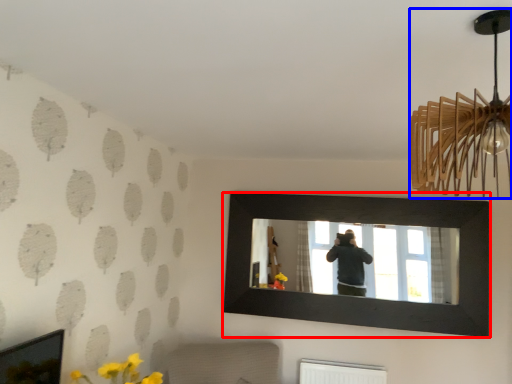
Question: Which point is further to the camera, picture frame (highlighted by a red box) or lamp (highlighted by a blue box)?

Choices:
 (A) picture frame
 (B) lamp

Answer: (A)